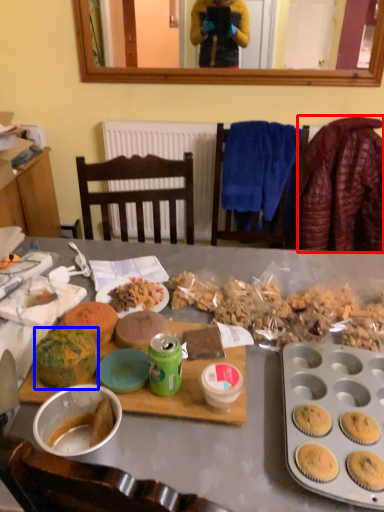
Question: Which point is closer to the camera, blanket (highlighted by a red box) or snack (highlighted by a blue box)?

Choices:
 (A) blanket
 (B) snack

Answer: (B)